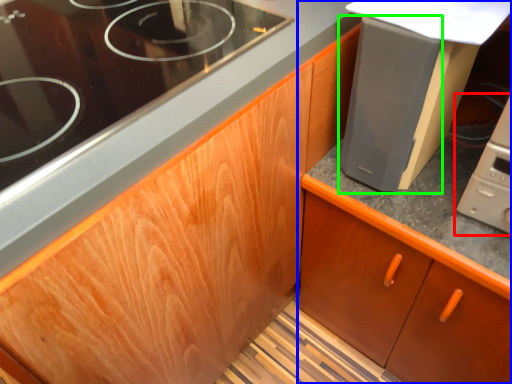
Question: Which object is the farthest from home appliance (highlighted by a red box)? Choose among these: cabinetry (highlighted by a blue box) or appliance (highlighted by a green box).

Choices:
 (A) cabinetry
 (B) appliance

Answer: (A)